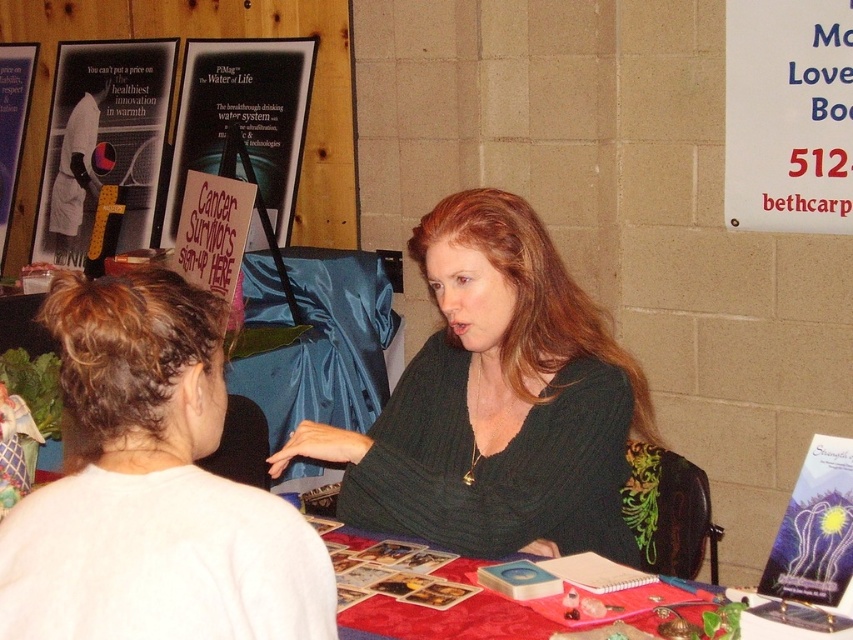
In the scene shown: You are at a community fair and want to find the red fabric table at center. Which direction should you look relative to the white paper sign at upper left?

The white paper sign at upper left is positioned on the left side of the red fabric table at center, so you should look to the right of the white paper sign at upper left to find the red fabric table at center.

You are organizing a community event and need to place a new banner on the table. The banner is 1 meter wide. The white paper sign at upper left and the matte black tennis racket at upper left are already on the table. Can you fit the banner between them?

The white paper sign at upper left is positioned on the right side of matte black tennis racket at upper left, so the space between them would depend on their combined widths. However, since the banner is 1 meter wide, it might not fit unless there is sufficient space. The exact dimensions of the objects and table aren

You are at a community fair and want to place a 3.5 feet wide banner between the white paper sign at upper right and the metallic silver poster at lower right. Can the banner fit in the space between them?

The white paper sign at upper right and metallic silver poster at lower right are 4.72 feet apart, so the banner can fit since it is shorter than the available space between them.